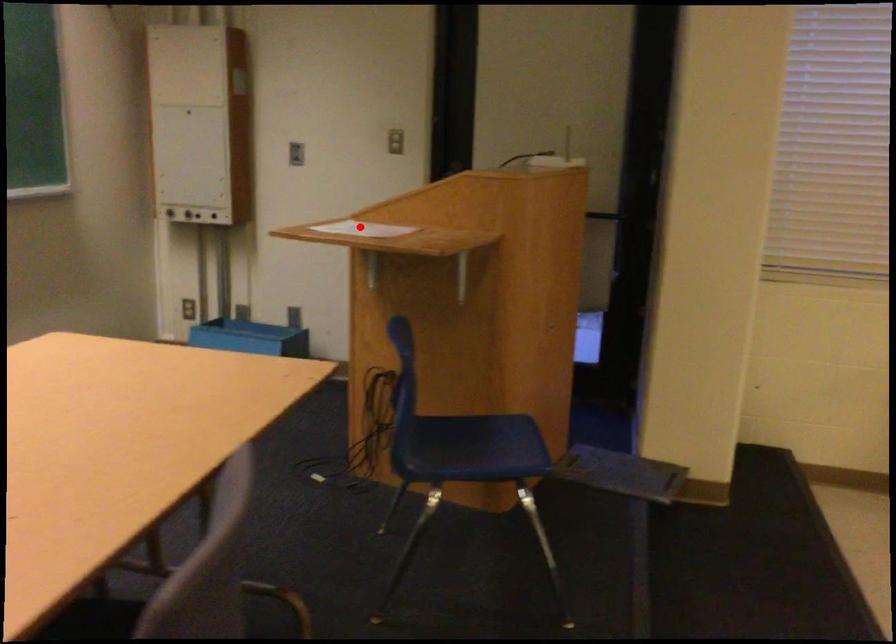
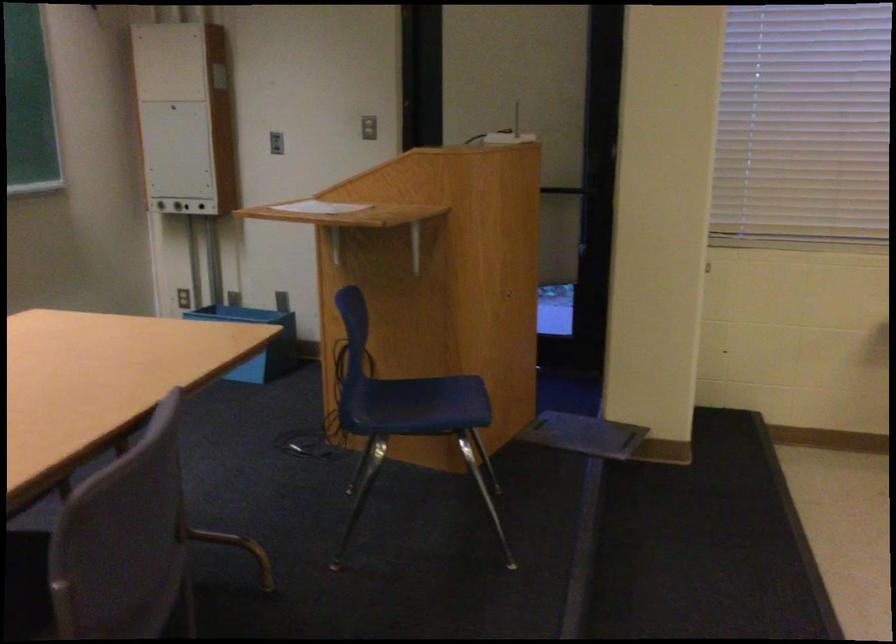
The point at the highlighted location is marked in the first image. Where is the corresponding point in the second image?

(320, 207)